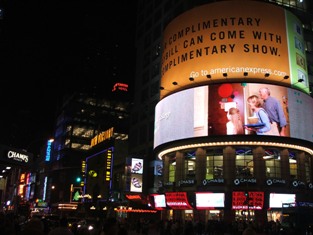
This screenshot has width=313, height=235. I want to click on red digital displays, so click(x=179, y=201), click(x=239, y=200).